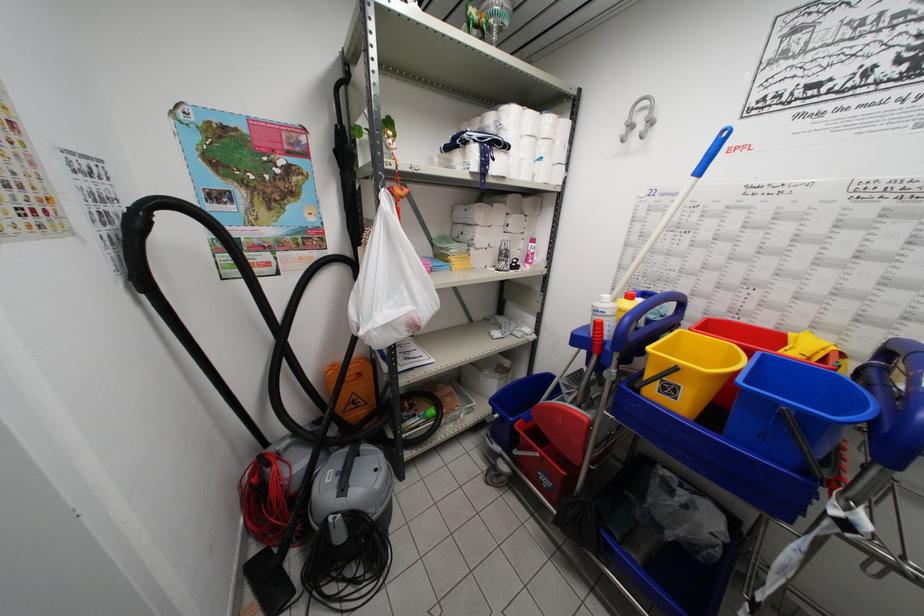
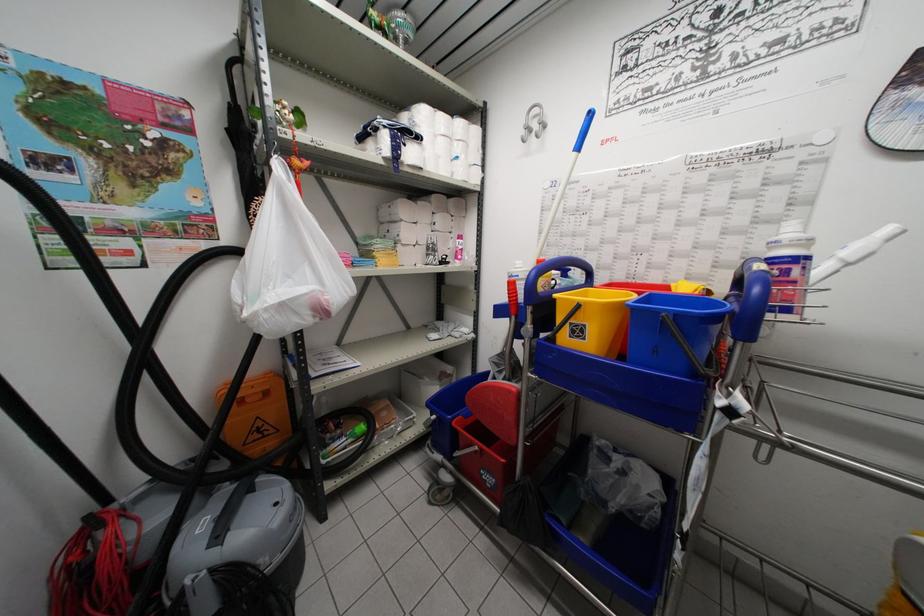
Which direction would the cameraman need to move to produce the second image?

The cameraman walked toward right, forward.